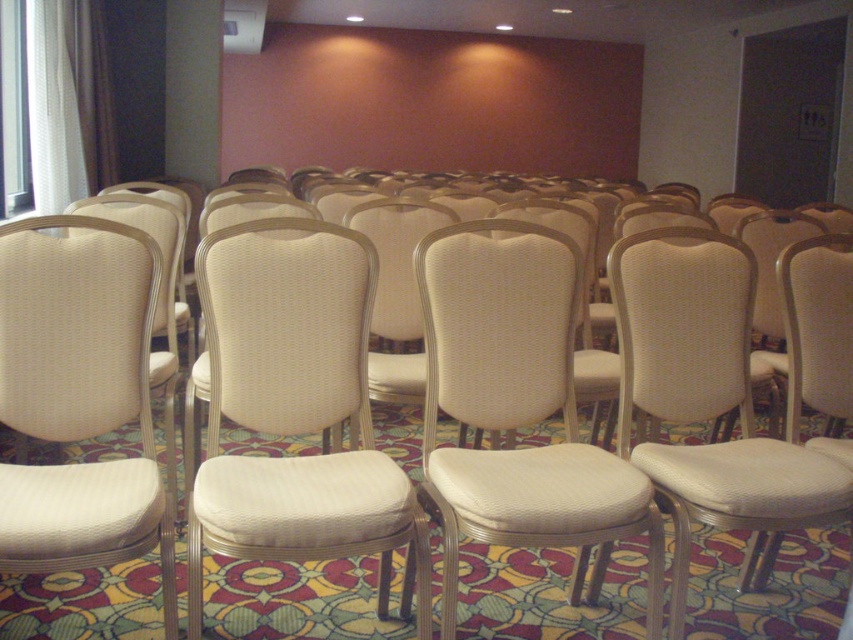
Question: Considering the relative positions of white textured chair at center and white fabric chair at center in the image provided, where is white textured chair at center located with respect to white fabric chair at center?

Choices:
 (A) above
 (B) below

Answer: (A)

Question: Can you confirm if white woven chair at center is wider than white fabric chair at center?

Choices:
 (A) no
 (B) yes

Answer: (B)

Question: Among these points, which one is nearest to the camera?

Choices:
 (A) (201, 504)
 (B) (54, 388)
 (C) (660, 413)

Answer: (A)

Question: Among these objects, which one is farthest from the camera?

Choices:
 (A) white textured chair at center
 (B) white fabric chair at right

Answer: (B)

Question: Can you confirm if white textured chair at center is thinner than white fabric chair at right?

Choices:
 (A) no
 (B) yes

Answer: (A)

Question: Which of these objects is positioned farthest from the white fabric chair at center?

Choices:
 (A) beige fabric chair at center
 (B) white woven chair at center
 (C) white textured chair at center
 (D) white fabric chair at right

Answer: (A)